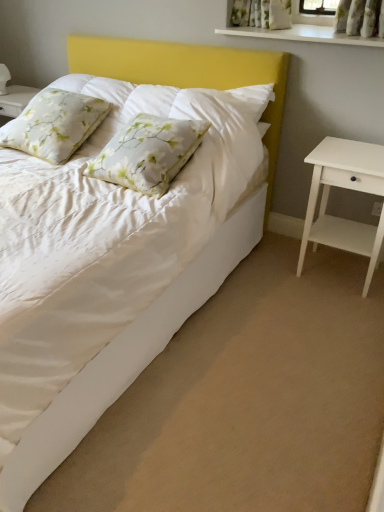
Question: Is white matte nightstand at right taller than white floral pillow at center, placed as the 1th pillow when sorted from right to left?

Choices:
 (A) yes
 (B) no

Answer: (A)

Question: Could you tell me if white matte nightstand at right is facing white floral pillow at center, positioned as the second pillow in left-to-right order?

Choices:
 (A) yes
 (B) no

Answer: (B)

Question: From the image's perspective, would you say white matte nightstand at right is positioned over white floral pillow at center, placed as the 1th pillow when sorted from right to left?

Choices:
 (A) no
 (B) yes

Answer: (A)

Question: From the image's perspective, is white matte nightstand at right beneath white floral pillow at center, positioned as the second pillow in left-to-right order?

Choices:
 (A) no
 (B) yes

Answer: (B)

Question: Can you confirm if white matte nightstand at right is shorter than white floral pillow at center, placed as the 1th pillow when sorted from right to left?

Choices:
 (A) no
 (B) yes

Answer: (A)

Question: Is white matte nightstand at right positioned with its back to white floral pillow at center, placed as the 1th pillow when sorted from right to left?

Choices:
 (A) no
 (B) yes

Answer: (A)

Question: Is there a large distance between white satin bed at lower left and floral fabric pillow at upper left, placed as the 2th pillow when sorted from right to left?

Choices:
 (A) no
 (B) yes

Answer: (B)

Question: Does white satin bed at lower left contain floral fabric pillow at upper left, placed as the 2th pillow when sorted from right to left?

Choices:
 (A) no
 (B) yes

Answer: (A)

Question: From the image's perspective, is white satin bed at lower left above floral fabric pillow at upper left, the 1th pillow in the left-to-right sequence?

Choices:
 (A) no
 (B) yes

Answer: (A)

Question: Is white satin bed at lower left oriented away from floral fabric pillow at upper left, placed as the 2th pillow when sorted from right to left?

Choices:
 (A) yes
 (B) no

Answer: (B)

Question: Is white satin bed at lower left at the right side of floral fabric pillow at upper left, the 1th pillow in the left-to-right sequence?

Choices:
 (A) no
 (B) yes

Answer: (B)

Question: Can you confirm if white satin bed at lower left is smaller than floral fabric pillow at upper left, the 1th pillow in the left-to-right sequence?

Choices:
 (A) yes
 (B) no

Answer: (B)

Question: Can white glossy shelf at upper center be found inside white satin bed at lower left?

Choices:
 (A) no
 (B) yes

Answer: (A)